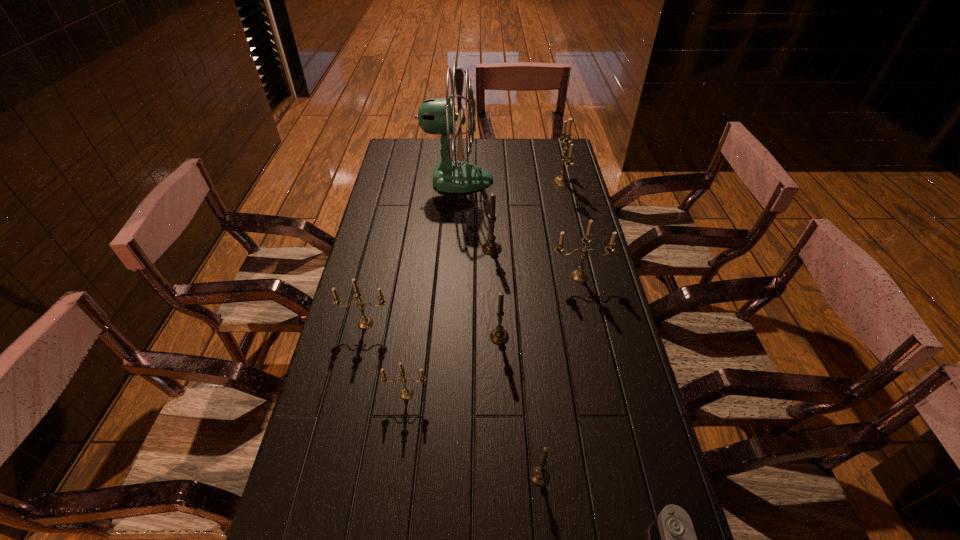
Locate an element on the screen. Image resolution: width=960 pixels, height=540 pixels. teal fan is located at coordinates (436, 116).

I want to click on the tallest object, so click(x=436, y=116).

Identify the location of the farthest metallic candle. This screenshot has width=960, height=540. (562, 180).

Where is `the second tallest object`? the second tallest object is located at coordinates [x=562, y=180].

At what (x,y) coordinates should I click in order to perform the action: click on the sixth nearest candle. Please return your answer as a coordinate pair (x, y). The width and height of the screenshot is (960, 540). Looking at the image, I should click on (491, 247).

Locate an element on the screen. the biggest gray candle is located at coordinates (491, 247).

I want to click on the second farthest metallic candle, so click(x=579, y=275).

Where is `the third farthest candle`? the third farthest candle is located at coordinates (579, 275).

Find the location of `the second nearest gray candle`. the second nearest gray candle is located at coordinates (499, 335).

The image size is (960, 540). Find the location of `the third biggest metallic candle`. the third biggest metallic candle is located at coordinates (365, 322).